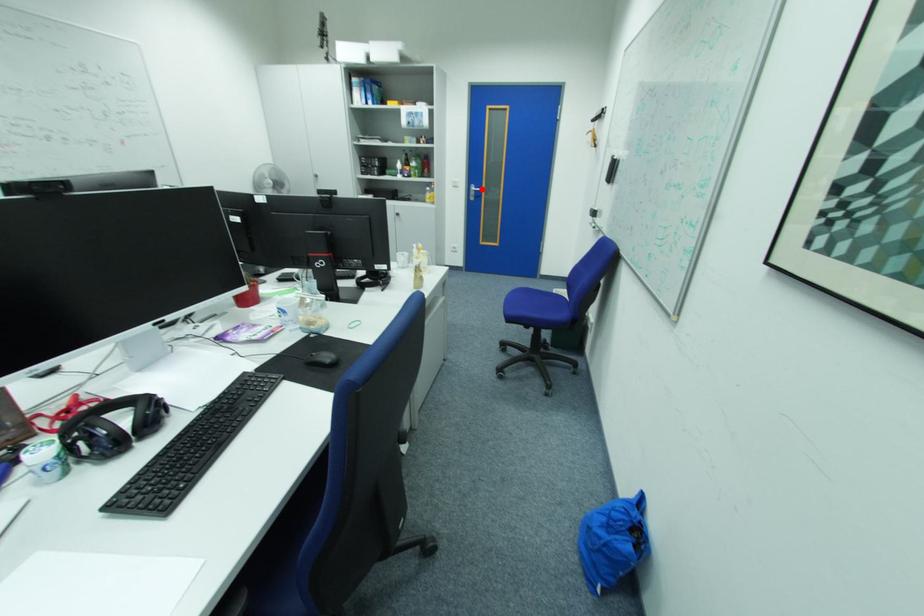
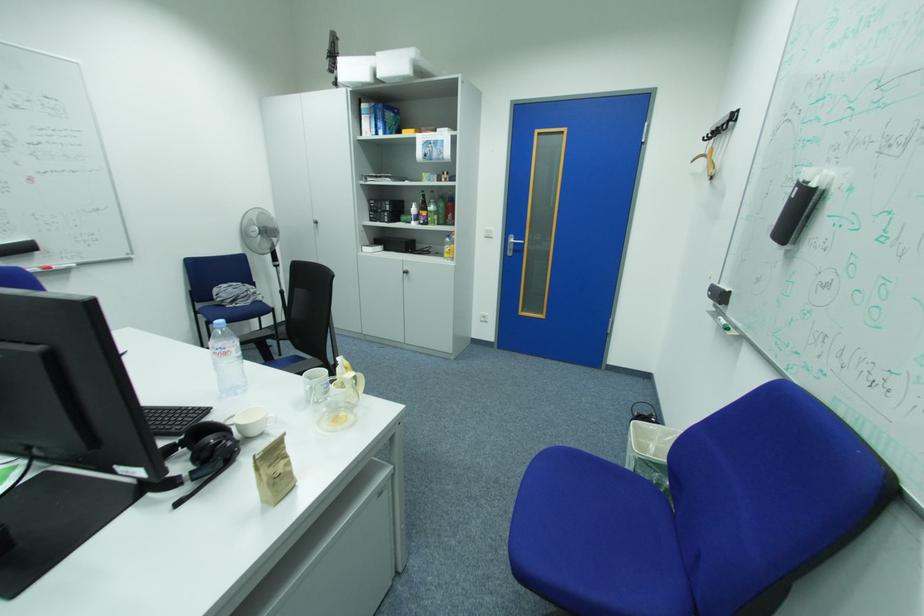
The point at the highlighted location is marked in the first image. Where is the corresponding point in the second image?

(520, 240)